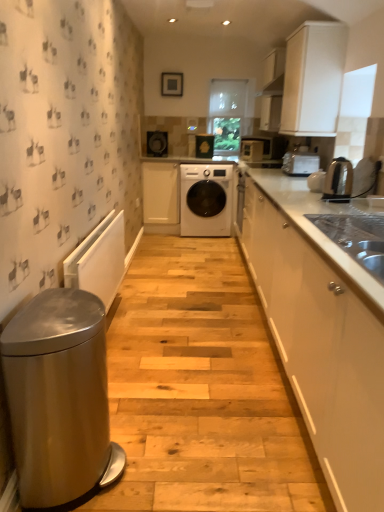
The width and height of the screenshot is (384, 512). Find the location of `free region on the left part of white glossy kettle at upper right, which is the fourth appliance in back-to-front order`. free region on the left part of white glossy kettle at upper right, which is the fourth appliance in back-to-front order is located at coordinates (289, 192).